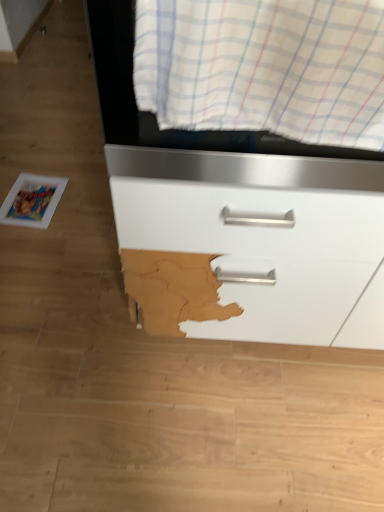
Question: Is point (134, 175) closer or farther from the camera than point (160, 70)?

Choices:
 (A) farther
 (B) closer

Answer: (A)

Question: From a real-world perspective, is matte white drawer at center above or below white striped fabric at upper center?

Choices:
 (A) below
 (B) above

Answer: (A)

Question: Which object is the closest to the white glossy magazine at lower left?

Choices:
 (A) matte white drawer at center
 (B) white striped fabric at upper center

Answer: (A)

Question: Based on their relative distances, which object is nearer to the white glossy magazine at lower left?

Choices:
 (A) white striped fabric at upper center
 (B) matte white drawer at center

Answer: (B)